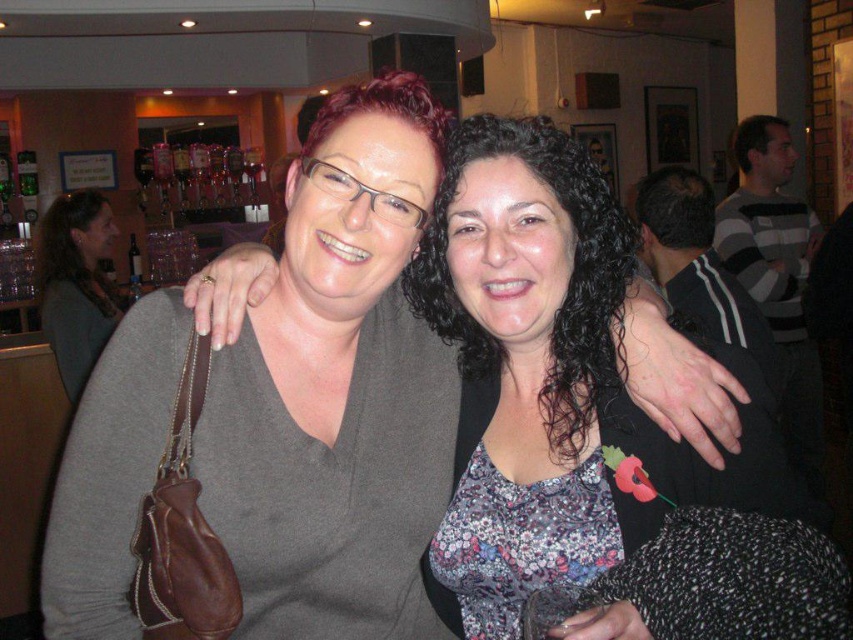
Is matte gray sweater at center to the left of matte gray sweater at left from the viewer's perspective?

In fact, matte gray sweater at center is to the right of matte gray sweater at left.

Is matte gray sweater at center shorter than matte gray sweater at left?

Indeed, matte gray sweater at center has a lesser height compared to matte gray sweater at left.

Find the location of a particular element. This screenshot has height=640, width=853. matte gray sweater at center is located at coordinates click(337, 392).

Find the location of `matte gray sweater at center`. matte gray sweater at center is located at coordinates (337, 392).